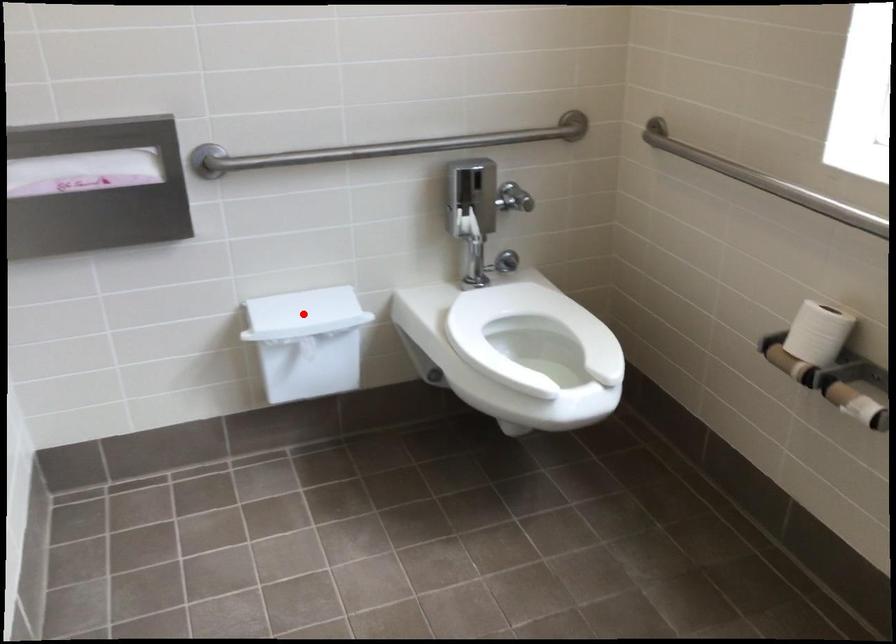
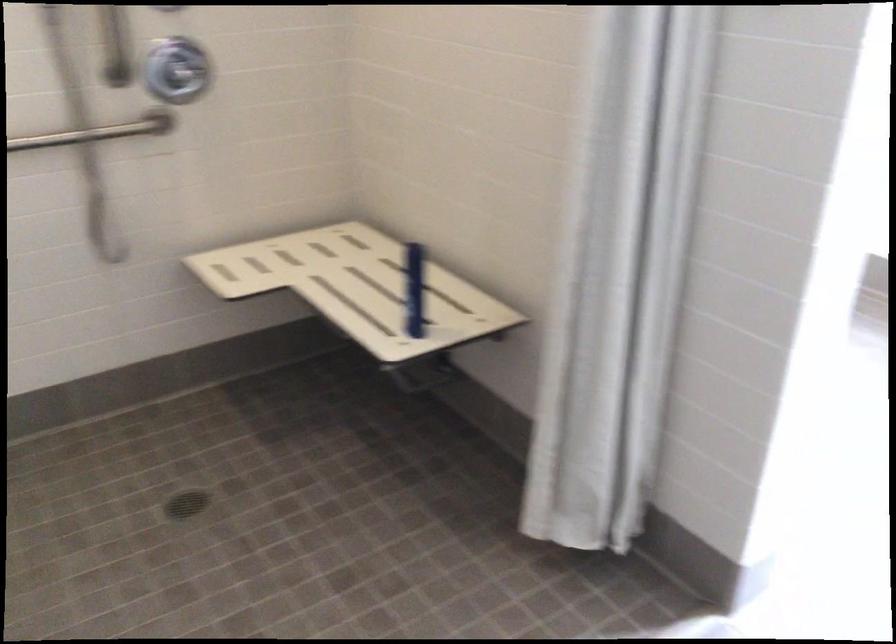
Question: I am providing you with two images of the same scene from different viewpoints. A red point is marked on the first image. At the location where the point appears in image 1, is it still visible in image 2?

Choices:
 (A) Yes
 (B) No

Answer: (B)